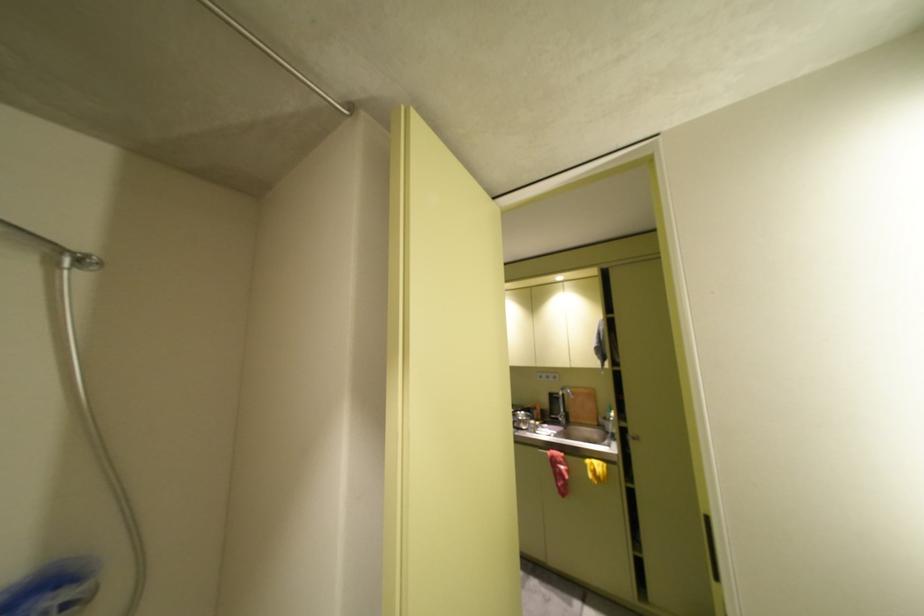
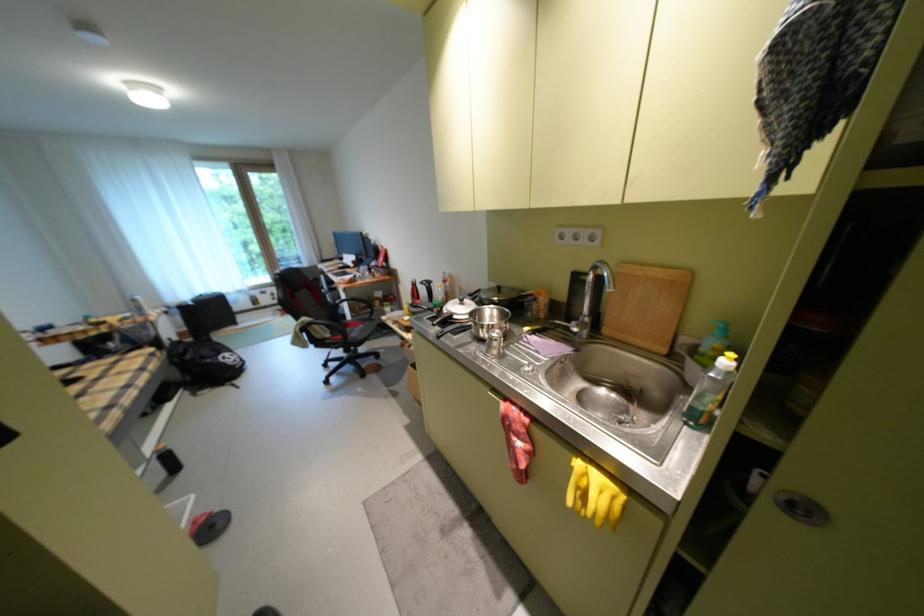
The point at [647,440] is marked in the first image. Where is the corresponding point in the second image?

(811, 511)